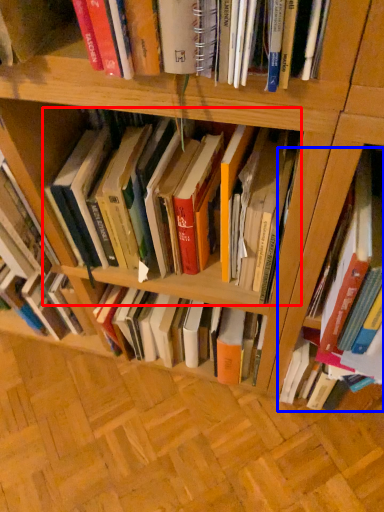
Question: Which point is further to the camera, book (highlighted by a red box) or book (highlighted by a blue box)?

Choices:
 (A) book
 (B) book

Answer: (A)